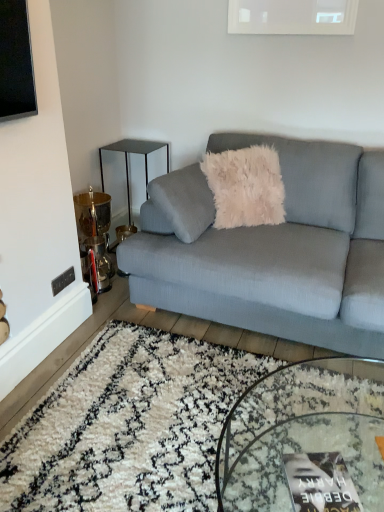
Find the location of `vacant space situated on the left part of clear glass coffee table at center`. vacant space situated on the left part of clear glass coffee table at center is located at coordinates [138, 440].